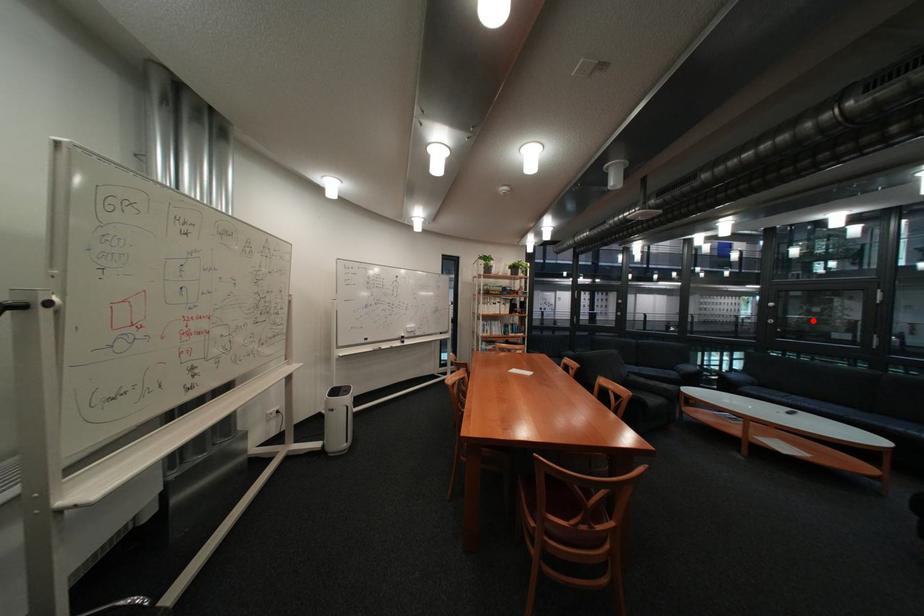
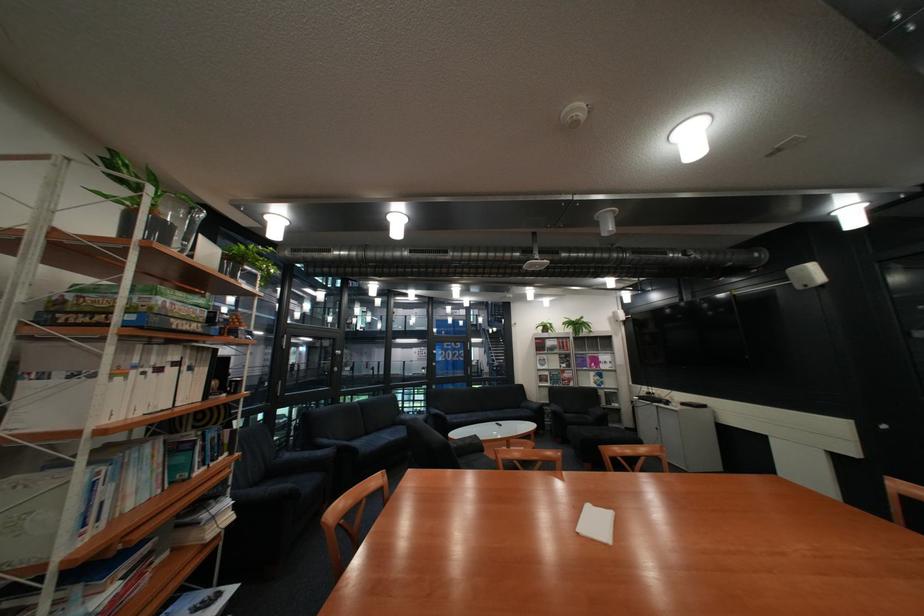
Question: I am providing you with two images of the same scene from different viewpoints. A red point is shown in image1. For the corresponding object point in image2, is it positioned nearer or farther from the camera?

Choices:
 (A) Nearer
 (B) Farther

Answer: (B)